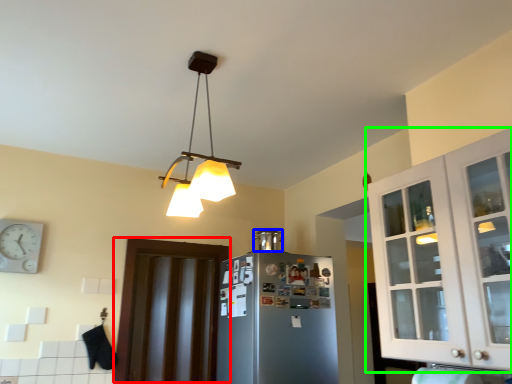
Question: Estimate the real-world distances between objects in this image. Which object is closer to door (highlighted by a red box), appliance (highlighted by a blue box) or cabinetry (highlighted by a green box)?

Choices:
 (A) appliance
 (B) cabinetry

Answer: (A)